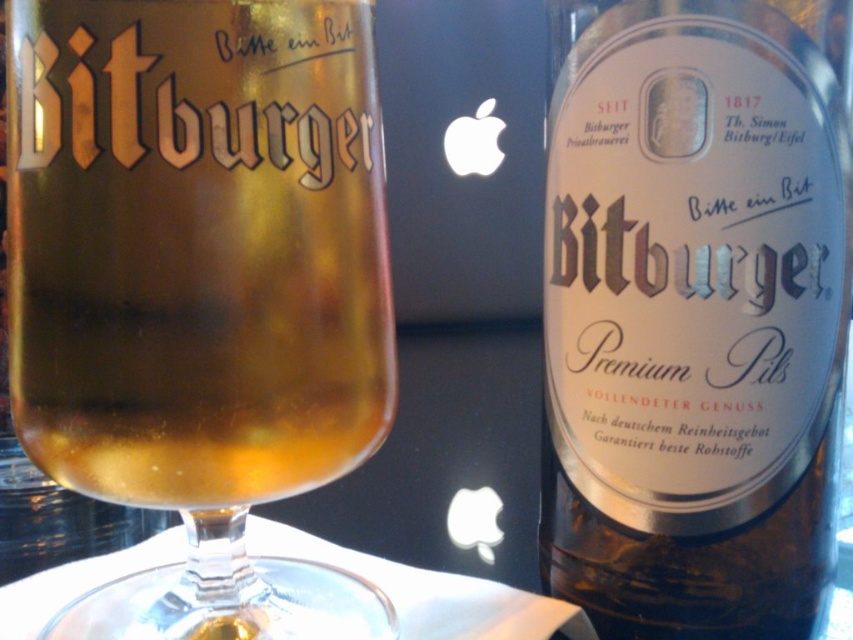
You are a bartender trying to pour the beer from the bottle into the glass. The bottle is on the right, and the glass is on the left. You want to pour the beer until it reaches the point labeled as point (200, 289). Where should you stop pouring the beer?

The point (200, 289) is on the translucent glass beer glass at center, so you should stop pouring when the beer reaches that point in the glass.

You are a photographer trying to capture the Bitburger Premium Pils bottle and glass. You notice two points in the image at coordinates point (115, 125) and point (556, 310). Which point is closer to the camera?

Point (115, 125) is in front of point (556, 310), so the point closer to the camera is point (115, 125).